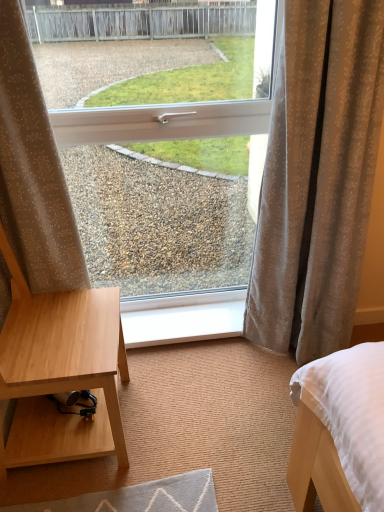
In order to click on vacant area on top of white plastic window sill at center (from a real-world perspective) in this screenshot , I will do `click(178, 320)`.